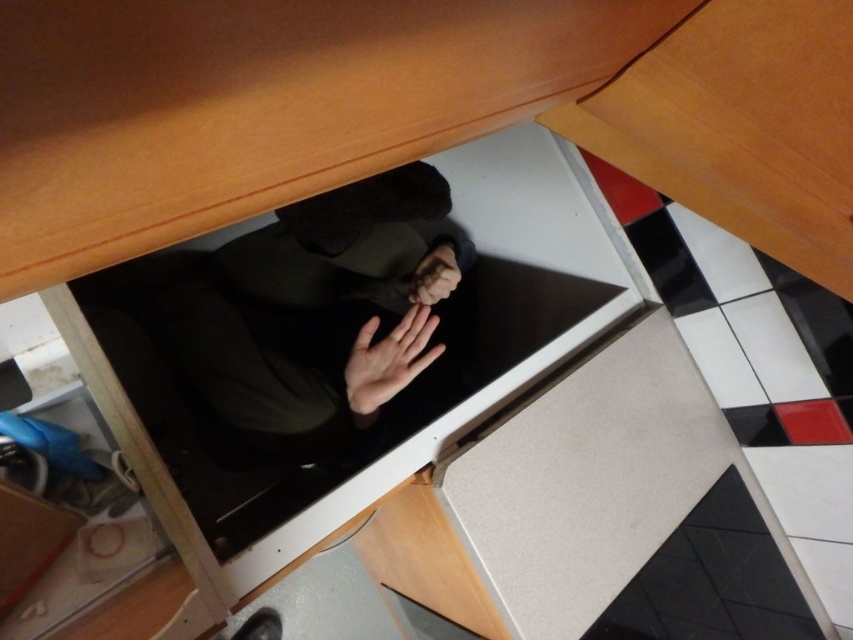
Is point (337, 288) behind point (440, 289)?

Yes, it is.

Does black matte laptop at center have a smaller size compared to matte black hand at center?

Incorrect, black matte laptop at center is not smaller in size than matte black hand at center.

The width and height of the screenshot is (853, 640). Describe the element at coordinates (294, 316) in the screenshot. I see `black matte laptop at center` at that location.

This screenshot has height=640, width=853. I want to click on black matte laptop at center, so click(294, 316).

Who is positioned more to the right, black matte laptop at center or smooth skin hand at center?

Positioned to the right is smooth skin hand at center.

Is black matte laptop at center thinner than smooth skin hand at center?

Incorrect, black matte laptop at center's width is not less than smooth skin hand at center's.

Does point (177, 280) come in front of point (354, 410)?

No.

At what (x,y) coordinates should I click in order to perform the action: click on black matte laptop at center. Please return your answer as a coordinate pair (x, y). Looking at the image, I should click on (294, 316).

Who is higher up, smooth skin hand at center or matte black hand at center?

matte black hand at center is above.

Who is shorter, smooth skin hand at center or matte black hand at center?

matte black hand at center

Which is in front, point (421, 333) or point (422, 275)?

Point (421, 333) is more forward.

The height and width of the screenshot is (640, 853). What are the coordinates of `smooth skin hand at center` in the screenshot? It's located at (387, 360).